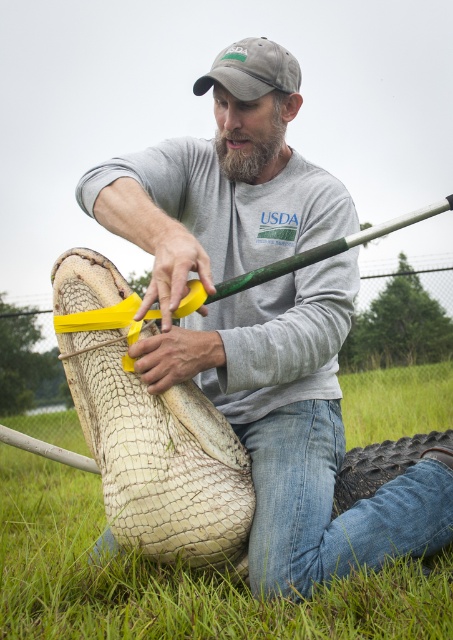
This screenshot has height=640, width=453. I want to click on leather textured boot at center, so click(x=236, y=480).

At what (x,y) coordinates should I click in order to perform the action: click on leather textured boot at center. Please return your answer as a coordinate pair (x, y). Looking at the image, I should click on (236, 480).

The height and width of the screenshot is (640, 453). I want to click on leather textured boot at center, so click(236, 480).